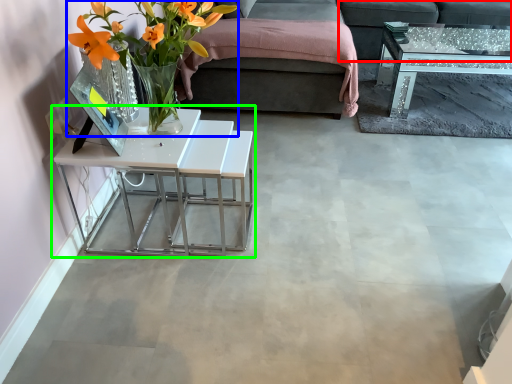
Question: Which is nearer to the couch (highlighted by a red box)? floral arrangement (highlighted by a blue box) or table (highlighted by a green box).

Choices:
 (A) floral arrangement
 (B) table

Answer: (B)